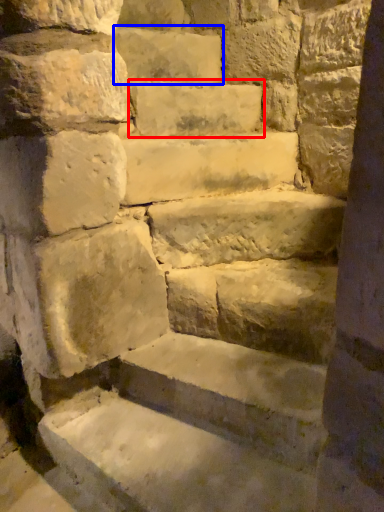
Question: Which object is further to the camera taking this photo, brick (highlighted by a red box) or brick (highlighted by a blue box)?

Choices:
 (A) brick
 (B) brick

Answer: (B)